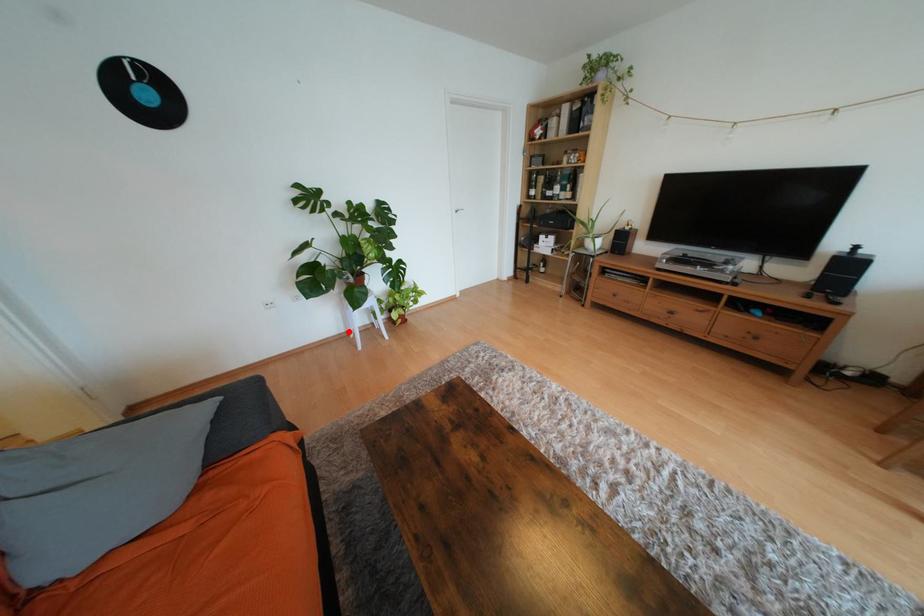
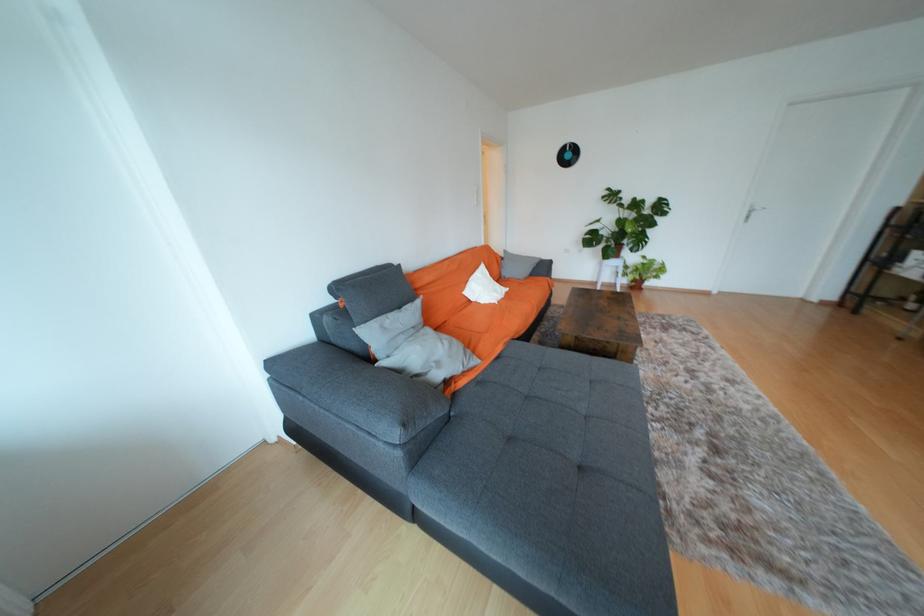
Find the pixel in the second image that matches the highlighted location in the first image.

(601, 282)